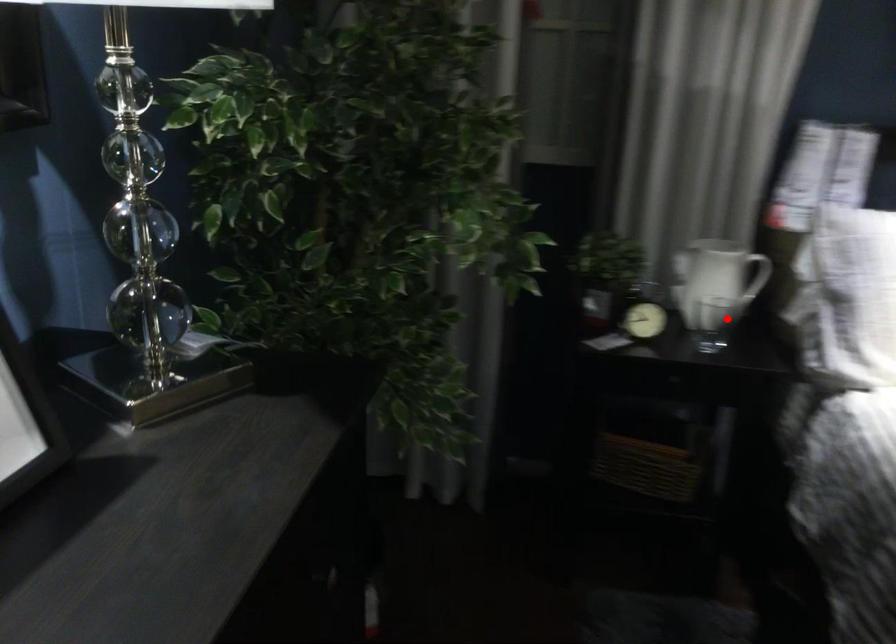
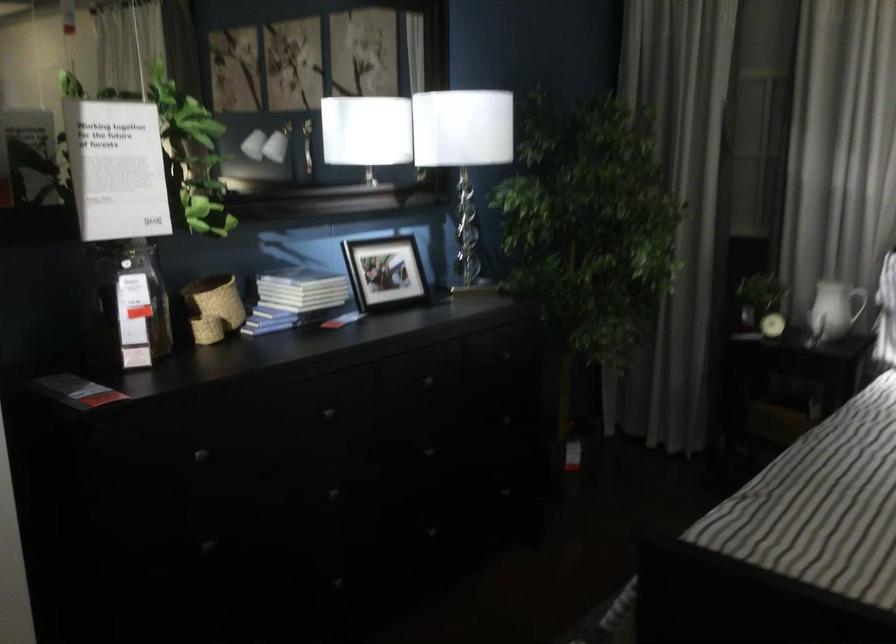
Question: I am providing you with two images of the same scene from different viewpoints. Given a red point in image1, look at the same physical point in image2. Is it:

Choices:
 (A) Closer to the viewpoint
 (B) Farther from the viewpoint

Answer: (B)